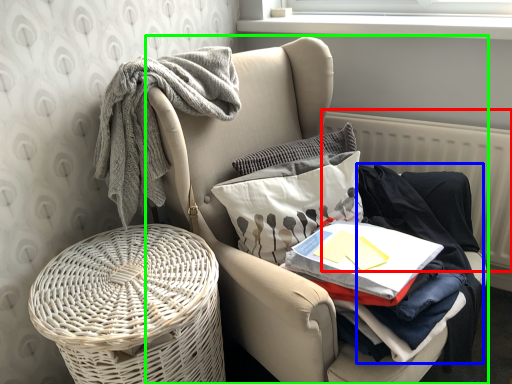
Question: Considering the real-world distances, which object is closest to radiator (highlighted by a red box)? clothing (highlighted by a blue box) or chair (highlighted by a green box).

Choices:
 (A) clothing
 (B) chair

Answer: (A)